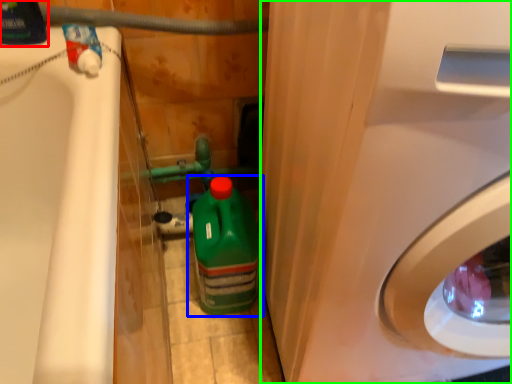
Question: Which object is positioned closest to cleaning product (highlighted by a red box)? Select from bottle (highlighted by a blue box) and washing machine (highlighted by a green box).

Choices:
 (A) bottle
 (B) washing machine

Answer: (A)